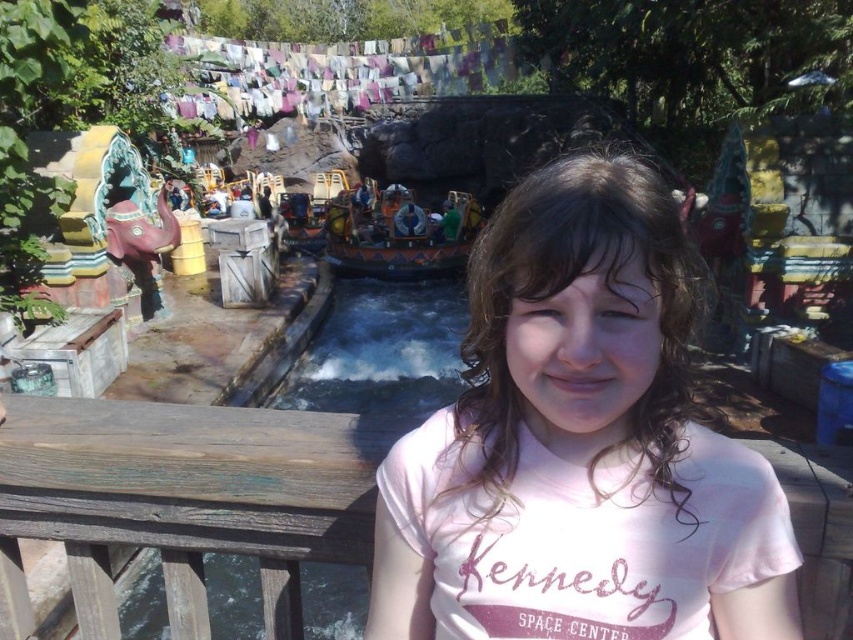
Question: Can you confirm if pink cotton shirt at center is thinner than wooden painted boat at center?

Choices:
 (A) yes
 (B) no

Answer: (A)

Question: Which point is farther to the camera?

Choices:
 (A) (601, 285)
 (B) (358, 259)
 (C) (500, 77)

Answer: (C)

Question: Which object is the farthest from the wooden painted boat at center?

Choices:
 (A) colorful fabric clothesline at upper center
 (B) pink cotton shirt at center

Answer: (B)

Question: Which object is farther from the camera taking this photo?

Choices:
 (A) colorful fabric clothesline at upper center
 (B) wooden painted boat at center

Answer: (A)

Question: In this image, where is pink cotton shirt at center located relative to wooden painted boat at center?

Choices:
 (A) left
 (B) right

Answer: (B)

Question: Can you confirm if pink cotton shirt at center is wider than colorful fabric clothesline at upper center?

Choices:
 (A) yes
 (B) no

Answer: (B)